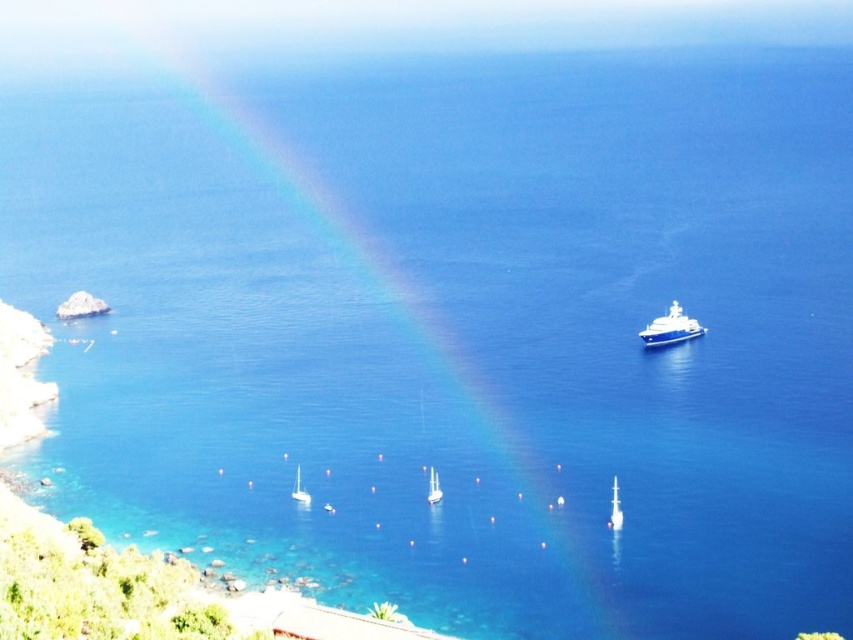
Question: Which point is farther from the camera taking this photo?

Choices:
 (A) pyautogui.click(x=316, y=100)
 (B) pyautogui.click(x=430, y=465)
 (C) pyautogui.click(x=297, y=490)

Answer: (A)

Question: Does white glossy boat at lower center have a larger size compared to white glossy sailboat at lower center?

Choices:
 (A) yes
 (B) no

Answer: (B)

Question: Can you confirm if rainbow at center is positioned above white glossy boat at lower center?

Choices:
 (A) yes
 (B) no

Answer: (A)

Question: Which of the following is the farthest from the observer?

Choices:
 (A) rainbow at center
 (B) white glossy boat at lower center
 (C) white glossy sailboat at center
 (D) white glossy sailboat at lower center

Answer: (D)

Question: Which of these objects is positioned farthest from the white glossy sailboat at lower center?

Choices:
 (A) white glossy sailboat at center
 (B) white glossy boat at lower center

Answer: (B)

Question: Is white glossy boat at lower center thinner than white glossy sailboat at lower center?

Choices:
 (A) no
 (B) yes

Answer: (B)